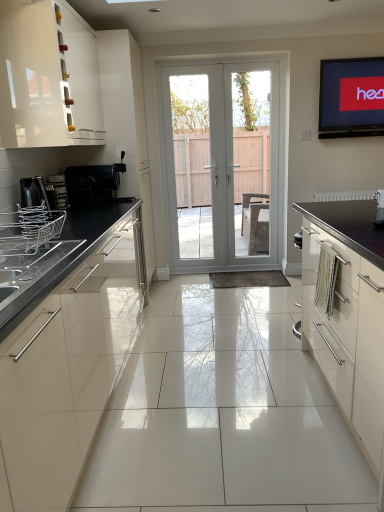
The image size is (384, 512). In order to click on free spot below satin silver dish rack at left, positioned as the 1th appliance in front-to-back order (from a real-world perspective) in this screenshot , I will do `click(20, 247)`.